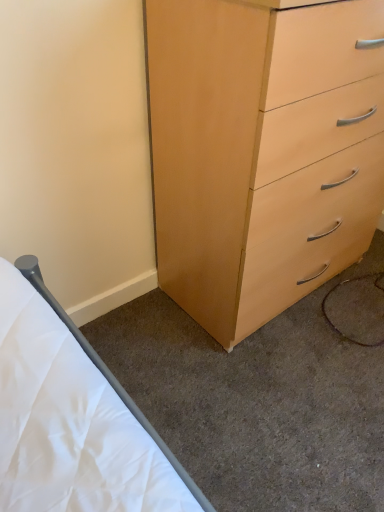
Identify the location of vacant area that is in front of light wood chest of drawers at right. This screenshot has width=384, height=512. (276, 389).